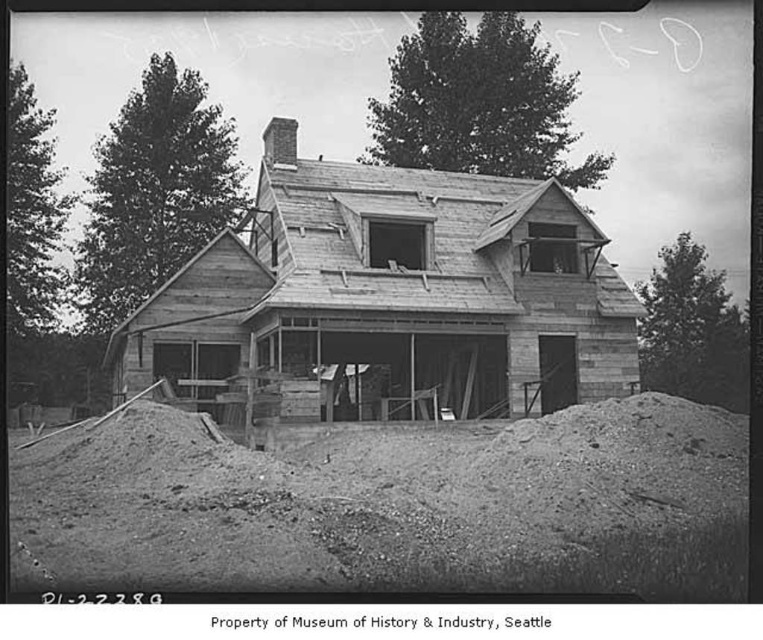
Question: Considering the relative positions of loose gravel at lower center and wooden house at center in the image provided, where is loose gravel at lower center located with respect to wooden house at center?

Choices:
 (A) below
 (B) above

Answer: (A)

Question: Which point is farther to the camera?

Choices:
 (A) (501, 493)
 (B) (356, 330)

Answer: (B)

Question: Which object is farther from the camera taking this photo?

Choices:
 (A) wooden house at center
 (B) loose gravel at lower center

Answer: (A)

Question: Can you confirm if loose gravel at lower center is positioned below wooden house at center?

Choices:
 (A) yes
 (B) no

Answer: (A)

Question: Which point appears farthest from the camera in this image?

Choices:
 (A) (345, 353)
 (B) (467, 580)

Answer: (A)

Question: Does loose gravel at lower center have a larger size compared to wooden house at center?

Choices:
 (A) no
 (B) yes

Answer: (A)